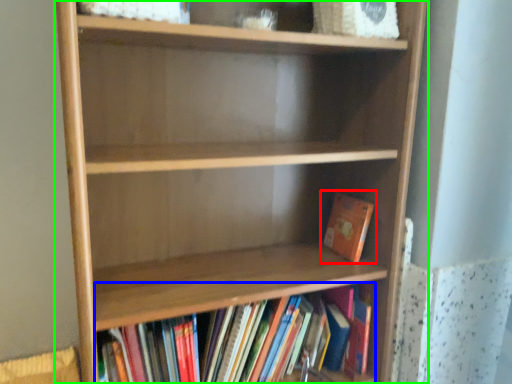
Question: Which is farther away from book (highlighted by a red box)? book (highlighted by a blue box) or shelf (highlighted by a green box)?

Choices:
 (A) book
 (B) shelf

Answer: (B)